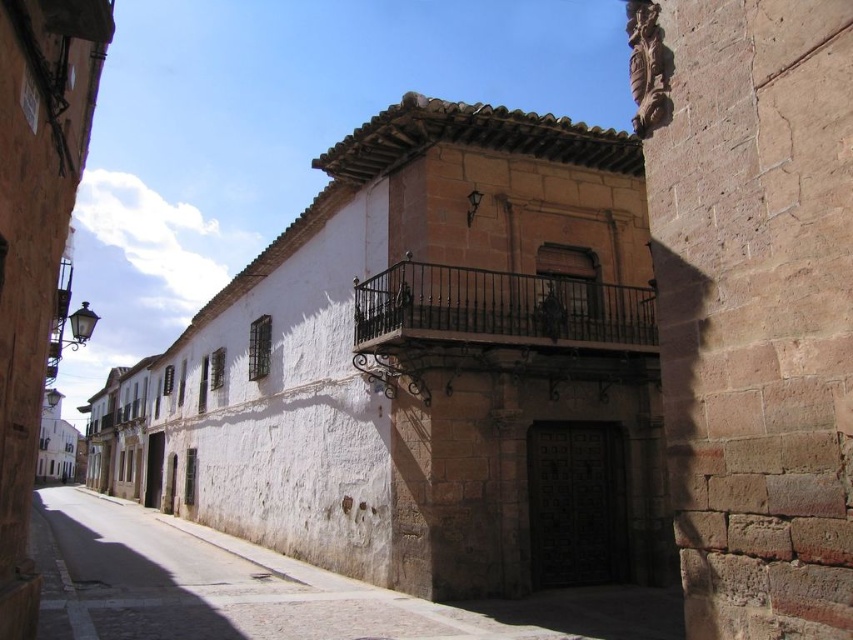
Does white stone wall at lower center lie in front of black wrought iron balcony at center?

Yes.

Between white stone wall at lower center and black wrought iron balcony at center, which one appears on the right side from the viewer's perspective?

black wrought iron balcony at center is more to the right.

Is point (282, 600) farther from camera compared to point (643, 342)?

No, it is not.

I want to click on white stone wall at lower center, so click(x=212, y=584).